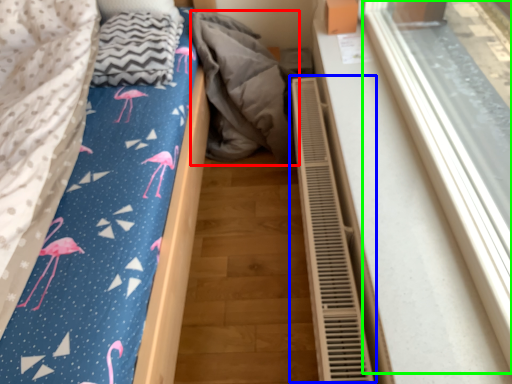
Question: Estimate the real-world distances between objects in this image. Which object is closer to material (highlighted by a red box), air conditioner (highlighted by a blue box) or window frame (highlighted by a green box)?

Choices:
 (A) air conditioner
 (B) window frame

Answer: (A)